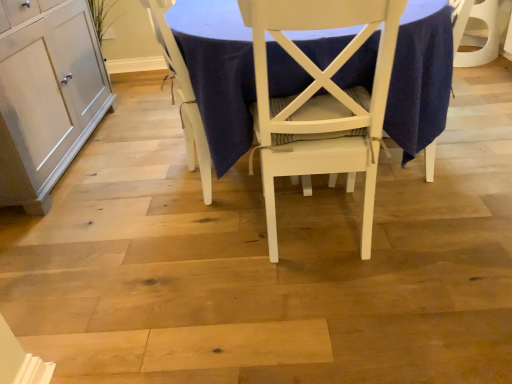
Question: Is white wood table at center thinner than white wood chair at center, the second chair from the right?

Choices:
 (A) yes
 (B) no

Answer: (B)

Question: From a real-world perspective, does white wood table at center sit lower than white wood chair at center, the second chair from the right?

Choices:
 (A) yes
 (B) no

Answer: (B)

Question: Considering the relative sizes of white wood table at center and white wood chair at center, the second chair from the right, in the image provided, is white wood table at center smaller than white wood chair at center, the second chair from the right,?

Choices:
 (A) yes
 (B) no

Answer: (B)

Question: Does white wood table at center come in front of white wood chair at center, arranged as the 1th chair when viewed from the left?

Choices:
 (A) no
 (B) yes

Answer: (B)

Question: Does white wood table at center come behind white wood chair at center, arranged as the 1th chair when viewed from the left?

Choices:
 (A) no
 (B) yes

Answer: (A)

Question: Is white wood table at center beside white wood chair at center, the second chair from the right?

Choices:
 (A) yes
 (B) no

Answer: (B)

Question: Is white painted wood chair at center, which ranks as the 1th chair in right-to-left order, facing away from matte white cabinet at left?

Choices:
 (A) yes
 (B) no

Answer: (B)

Question: Considering the relative sizes of white painted wood chair at center, the second chair in the left-to-right sequence, and matte white cabinet at left in the image provided, is white painted wood chair at center, the second chair in the left-to-right sequence, thinner than matte white cabinet at left?

Choices:
 (A) no
 (B) yes

Answer: (A)

Question: From a real-world perspective, does white painted wood chair at center, the second chair in the left-to-right sequence, stand above matte white cabinet at left?

Choices:
 (A) yes
 (B) no

Answer: (A)

Question: Considering the relative positions of white painted wood chair at center, which ranks as the 1th chair in right-to-left order, and matte white cabinet at left in the image provided, is white painted wood chair at center, which ranks as the 1th chair in right-to-left order, to the right of matte white cabinet at left from the viewer's perspective?

Choices:
 (A) yes
 (B) no

Answer: (A)

Question: Does white painted wood chair at center, the second chair in the left-to-right sequence, lie in front of matte white cabinet at left?

Choices:
 (A) no
 (B) yes

Answer: (B)

Question: Considering the relative sizes of white painted wood chair at center, which ranks as the 1th chair in right-to-left order, and matte white cabinet at left in the image provided, is white painted wood chair at center, which ranks as the 1th chair in right-to-left order, smaller than matte white cabinet at left?

Choices:
 (A) yes
 (B) no

Answer: (A)

Question: From the image's perspective, is matte white cabinet at left located beneath white wood table at center?

Choices:
 (A) yes
 (B) no

Answer: (A)